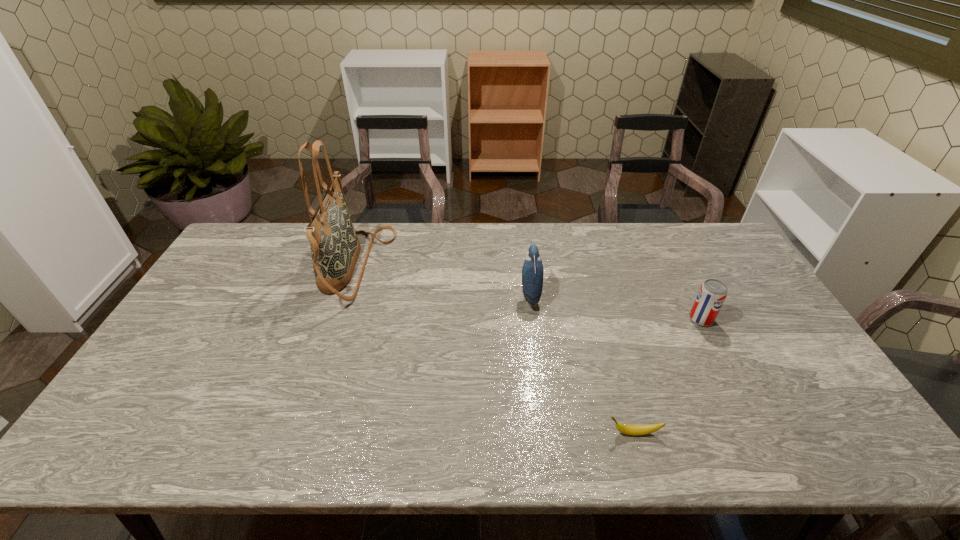
The width and height of the screenshot is (960, 540). In the image, there is a desktop. What are the coordinates of `blank space at the left edge` in the screenshot? It's located at (244, 293).

Locate an element on the screen. The height and width of the screenshot is (540, 960). free space at the right edge is located at coordinates (710, 275).

In the image, there is a desktop. Identify the location of free space at the far right corner. The image size is (960, 540). (675, 227).

Identify the location of vacant space in between the third tallest object and the shortest object. The height and width of the screenshot is (540, 960). 667,376.

Where is `free point between the nearest object and the soda`? The width and height of the screenshot is (960, 540). free point between the nearest object and the soda is located at coordinates (667, 376).

Where is `vacant area between the second object from left to right and the banana`? The width and height of the screenshot is (960, 540). vacant area between the second object from left to right and the banana is located at coordinates (582, 364).

Image resolution: width=960 pixels, height=540 pixels. In order to click on vacant area that lies between the third object from right to left and the soda in this screenshot , I will do `click(615, 307)`.

You are a GUI agent. You are given a task and a screenshot of the screen. Output one action in this format:
    pyautogui.click(x=<x>, y=<y>)
    Task: Click on the free space that is in between the nearest object and the handbag
    
    Given the screenshot: What is the action you would take?
    pyautogui.click(x=494, y=349)

Where is `vacant area that lies between the nearest object and the bird`? The image size is (960, 540). vacant area that lies between the nearest object and the bird is located at coordinates (582, 364).

You are a GUI agent. You are given a task and a screenshot of the screen. Output one action in this format:
    pyautogui.click(x=<x>, y=<y>)
    Task: Click on the unoccupied position between the nearest object and the tallest object
    
    Given the screenshot: What is the action you would take?
    pyautogui.click(x=494, y=349)